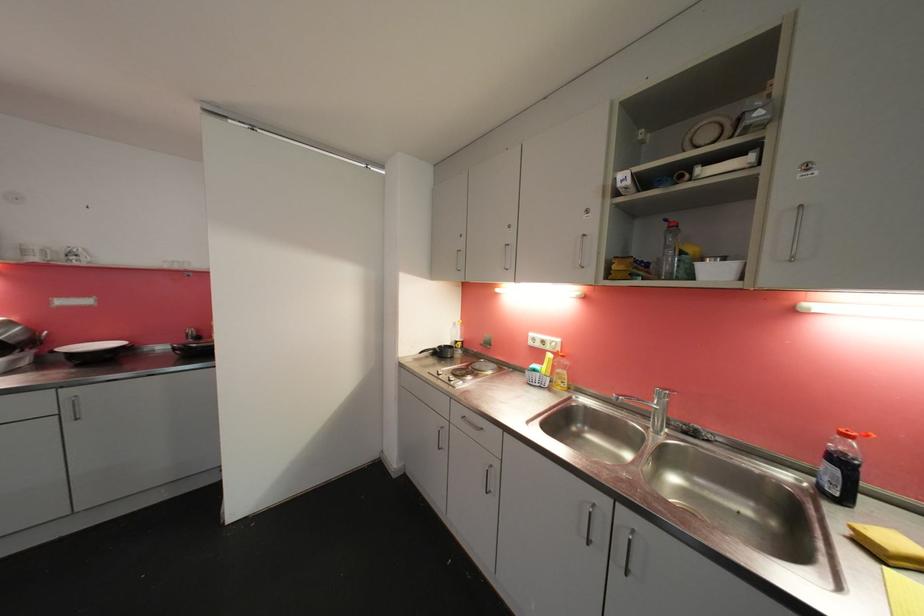
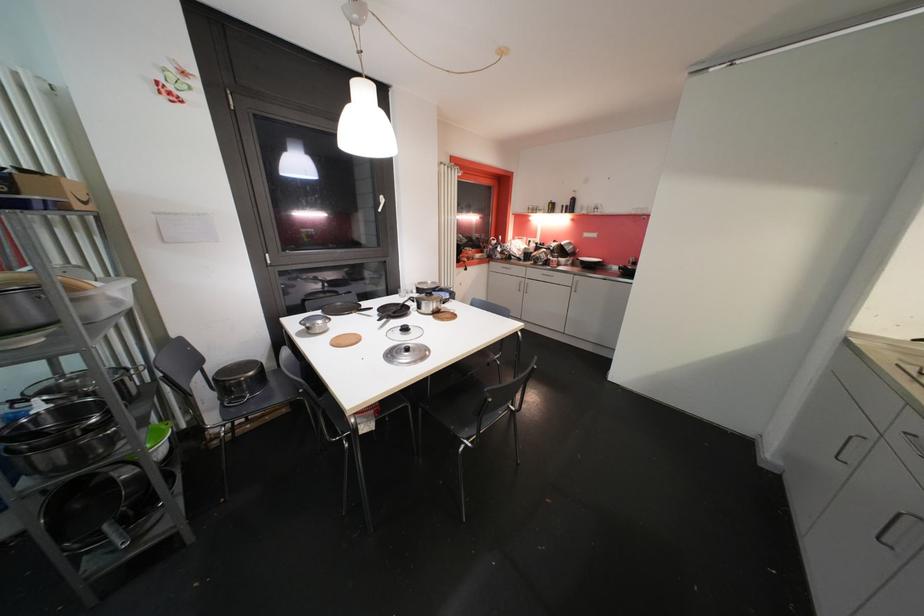
Locate, in the second image, the point that corresponds to pixel 39 406 in the first image.

(572, 282)